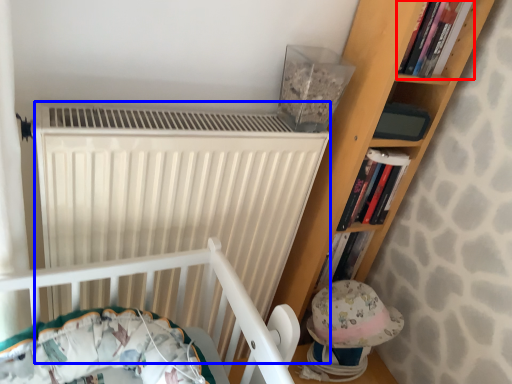
Question: Among these objects, which one is nearest to the camera, book (highlighted by a red box) or radiator (highlighted by a blue box)?

Choices:
 (A) book
 (B) radiator

Answer: (B)